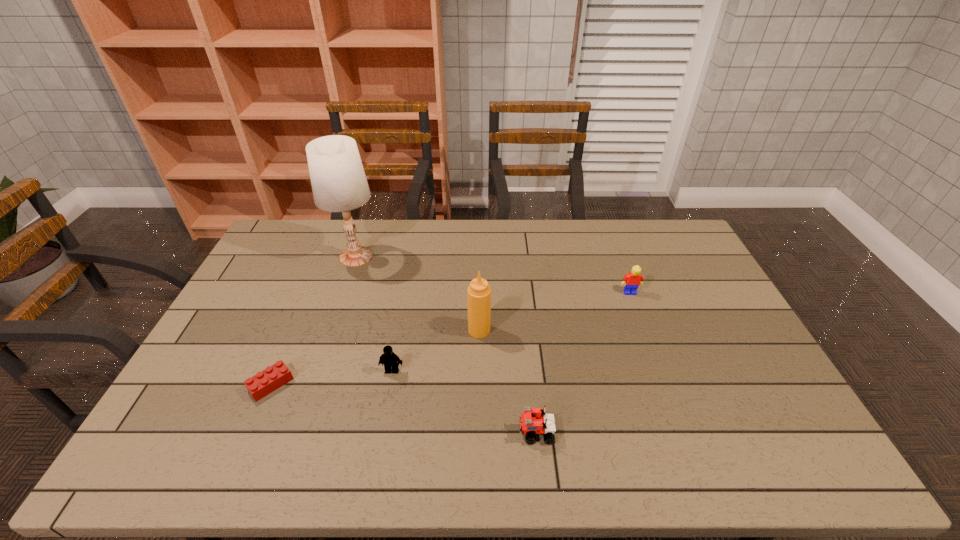
Locate which Lego ranks in proximity to the condiment. Please provide its 2D coordinates. Your answer should be formatted as a tuple, i.e. [(x, y)], where the tuple contains the x and y coordinates of a point satisfying the conditions above.

[(389, 358)]